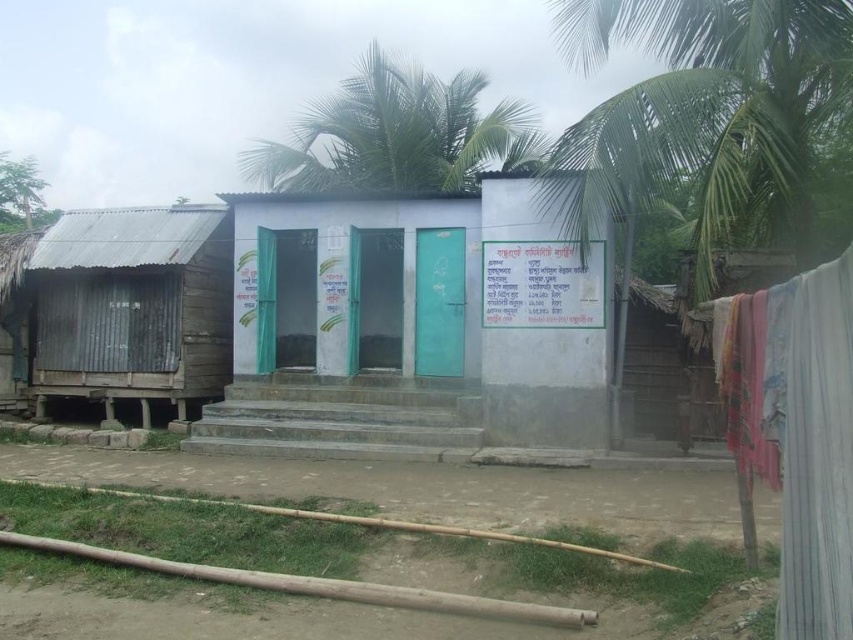
You are standing at the base of the steps leading to the white painted concrete toilet at center and the green leafy palm tree at upper right. Which object is closer to you?

The white painted concrete toilet at center is closer to you because it is further to the viewer than the green leafy palm tree at upper right, meaning it appears nearer in the scene.

You are a maintenance worker assigned to check the white painted concrete toilet at center and the green leafy palm tree at upper right. Which object has a narrower width?

The white painted concrete toilet at center is thinner than the green leafy palm tree at upper right, so the white painted concrete toilet at center has a narrower width.

You are standing in front of the restroom building and want to know which object is wider between the green leafy palm tree at upper right and the white fabric at lower right. Can you determine which one is wider?

The green leafy palm tree at upper right is wider than the white fabric at lower right according to the description.